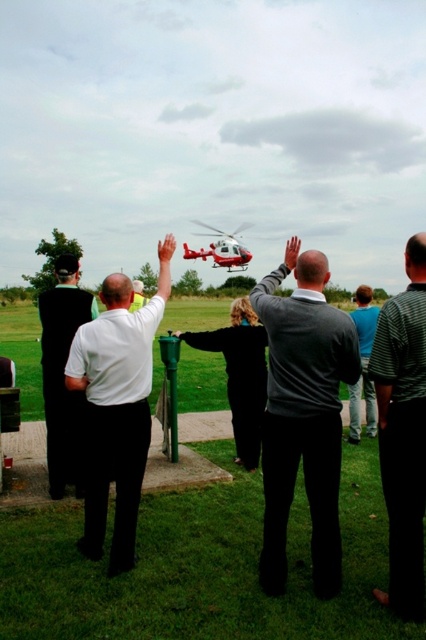
Is the position of blue cotton shirt at center less distant than that of red glossy helicopter at center?

That is True.

Is point (356, 422) positioned behind point (226, 246)?

No, it is not.

Locate an element on the screen. This screenshot has width=426, height=640. blue cotton shirt at center is located at coordinates (362, 365).

Who is higher up, striped shirt at center or red glossy helicopter at center?

red glossy helicopter at center

Is the position of striped shirt at center more distant than that of red glossy helicopter at center?

No, striped shirt at center is closer to the viewer.

The width and height of the screenshot is (426, 640). Describe the element at coordinates (402, 432) in the screenshot. I see `striped shirt at center` at that location.

You are a GUI agent. You are given a task and a screenshot of the screen. Output one action in this format:
    pyautogui.click(x=<x>, y=<y>)
    Task: Click on the striped shirt at center
    This screenshot has height=640, width=426.
    Given the screenshot: What is the action you would take?
    pyautogui.click(x=402, y=432)

Between black matte suit at left and red glossy helicopter at center, which one is positioned higher?

red glossy helicopter at center

Which of these two, black matte suit at left or red glossy helicopter at center, stands taller?

red glossy helicopter at center

Does point (46, 300) come farther from viewer compared to point (184, 253)?

That is False.

Where is `black matte suit at left`? This screenshot has height=640, width=426. black matte suit at left is located at coordinates (63, 376).